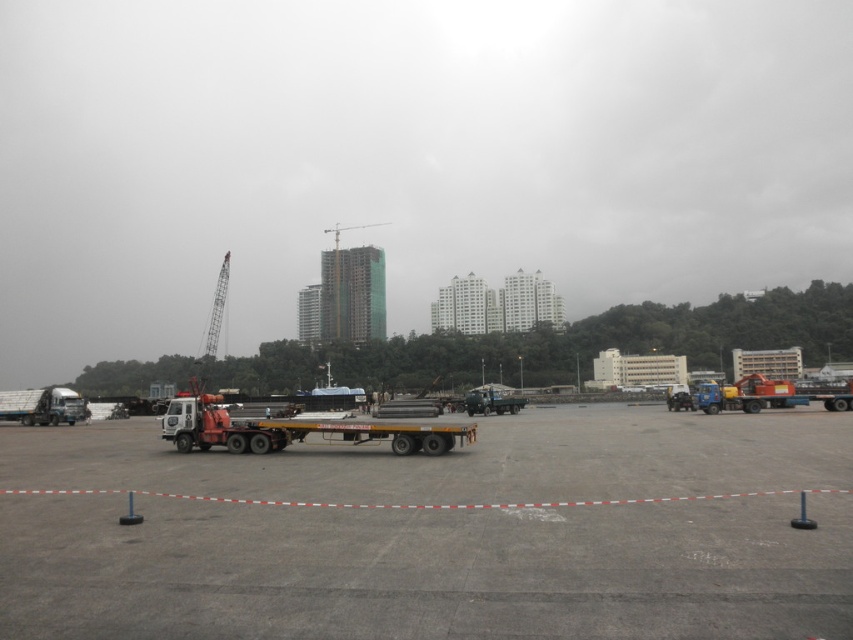
Which is above, gray concrete tarmac at center or orange metallic tow truck at center?

gray concrete tarmac at center is higher up.

Which is below, gray concrete tarmac at center or orange metallic tow truck at center?

orange metallic tow truck at center is lower down.

Between point (602, 593) and point (352, 438), which one is positioned behind?

Positioned behind is point (352, 438).

This screenshot has height=640, width=853. I want to click on gray concrete tarmac at center, so click(x=438, y=532).

Locate an element on the screen. orange metallic tow truck at center is located at coordinates (294, 429).

The image size is (853, 640). In order to click on orange metallic tow truck at center in this screenshot , I will do `click(294, 429)`.

Find the location of a particular element. This screenshot has width=853, height=640. orange metallic tow truck at center is located at coordinates (294, 429).

Between gray concrete tarmac at center and green glassy building at center, which one is positioned lower?

Positioned lower is gray concrete tarmac at center.

Is gray concrete tarmac at center wider than green glassy building at center?

Yes.

This screenshot has height=640, width=853. What do you see at coordinates (438, 532) in the screenshot?
I see `gray concrete tarmac at center` at bounding box center [438, 532].

Find the location of a particular element. gray concrete tarmac at center is located at coordinates (438, 532).